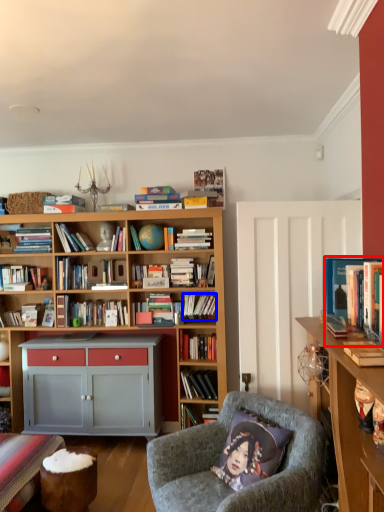
Question: Among these objects, which one is farthest to the camera, book (highlighted by a red box) or book (highlighted by a blue box)?

Choices:
 (A) book
 (B) book

Answer: (B)